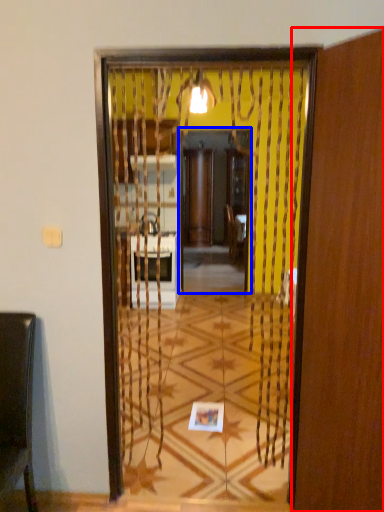
Question: Which of the following is the farthest to the observer, screen door (highlighted by a red box) or screen door (highlighted by a blue box)?

Choices:
 (A) screen door
 (B) screen door

Answer: (B)